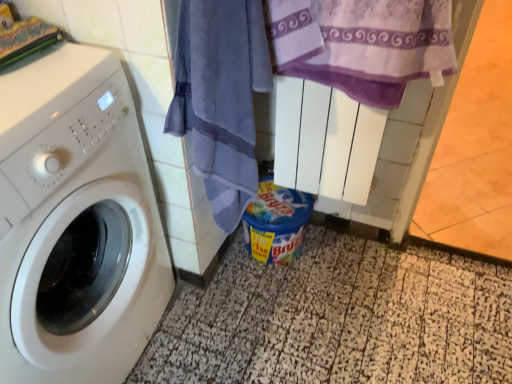
Question: From the image's perspective, is white glossy washing machine at left located above or below blue cotton towel at center, which is counted as the second beach towel, starting from the right?

Choices:
 (A) above
 (B) below

Answer: (B)

Question: Considering their positions, is white glossy washing machine at left located in front of or behind blue cotton towel at center, which is counted as the second beach towel, starting from the right?

Choices:
 (A) front
 (B) behind

Answer: (A)

Question: Which of these objects is positioned farthest from the blue cotton towel at center, which is counted as the second beach towel, starting from the right?

Choices:
 (A) white glossy washing machine at left
 (B) speckled tile at lower center
 (C) blue plastic container at lower center
 (D) purple textured towel at upper right, which is counted as the first beach towel, starting from the right

Answer: (B)

Question: Which object is positioned farthest from the blue cotton towel at center, the first beach towel from the left?

Choices:
 (A) purple textured towel at upper right, the second beach towel from the left
 (B) white glossy washing machine at left
 (C) speckled tile at lower center
 (D) blue plastic container at lower center

Answer: (C)